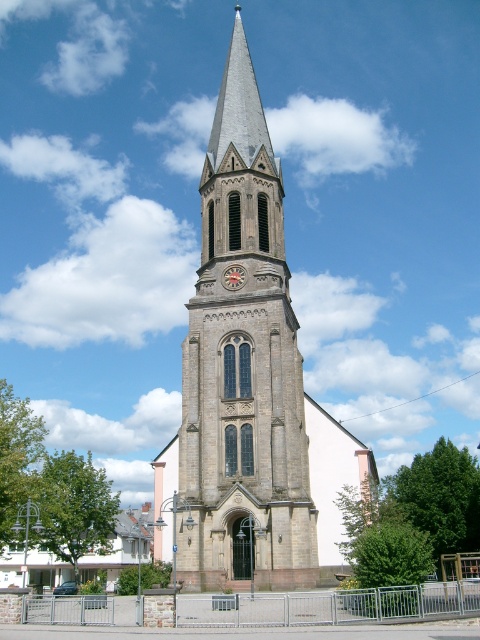
Question: Does brown stone clock tower at center appear over red painted wooden clock at center?

Choices:
 (A) no
 (B) yes

Answer: (B)

Question: Can you confirm if brown stone clock tower at center is positioned to the right of red painted wooden clock at center?

Choices:
 (A) no
 (B) yes

Answer: (A)

Question: Which point is closer to the camera?

Choices:
 (A) (265, 221)
 (B) (231, 275)

Answer: (B)

Question: Can you confirm if brown stone clock tower at center is bigger than red painted wooden clock at center?

Choices:
 (A) no
 (B) yes

Answer: (B)